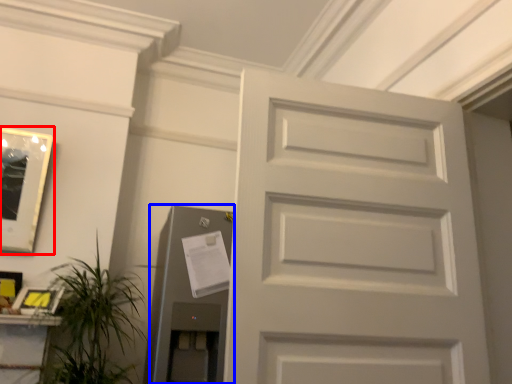
Question: Which of the following is the closest to the observer, picture frame (highlighted by a red box) or elevator (highlighted by a blue box)?

Choices:
 (A) picture frame
 (B) elevator

Answer: (B)